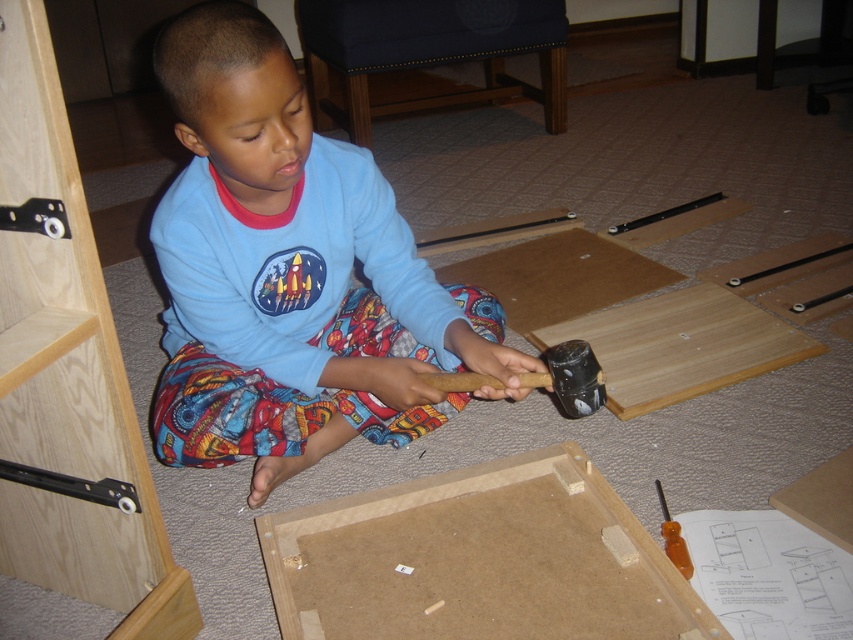
Question: Which point appears farthest from the camera in this image?

Choices:
 (A) pos(364,214)
 (B) pos(461,387)

Answer: (A)

Question: Does blue cotton shirt at center appear over black rubber hammer at center?

Choices:
 (A) no
 (B) yes

Answer: (B)

Question: Which of the following is the closest to the observer?

Choices:
 (A) (399, 268)
 (B) (486, 376)

Answer: (B)

Question: Which point is closer to the camera?

Choices:
 (A) (270, 332)
 (B) (585, 413)

Answer: (B)

Question: Is blue cotton shirt at center positioned at the back of black rubber hammer at center?

Choices:
 (A) yes
 (B) no

Answer: (B)

Question: Observing the image, what is the correct spatial positioning of blue cotton shirt at center in reference to black rubber hammer at center?

Choices:
 (A) below
 (B) above

Answer: (B)